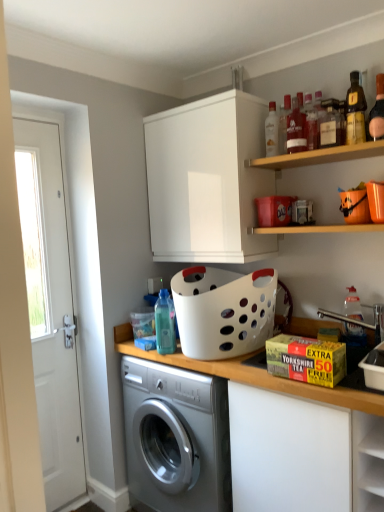
Question: Is clear glass bottle at upper center, which is counted as the second bottle, starting from the left, inside or outside of translucent glass bottle at upper right, placed as the ninth bottle when sorted from left to right?

Choices:
 (A) outside
 (B) inside

Answer: (A)

Question: From a real-world perspective, relative to translucent glass bottle at upper right, which is the first bottle from right to left, is clear glass bottle at upper center, which is counted as the second bottle, starting from the left, vertically above or below?

Choices:
 (A) below
 (B) above

Answer: (A)

Question: Which object is the closest to the translucent plastic bottle at upper center, the 3th bottle viewed from the left?

Choices:
 (A) wooden shelf at upper right, which is the second shelf from top to bottom
 (B) matte glass bottle at upper center, which ranks as the 4th bottle in left-to-right order
 (C) white matte cabinet at upper center
 (D) wooden shelf at upper right, the second shelf when ordered from bottom to top
 (E) matte plastic bottle at upper right, placed as the fifth bottle when sorted from left to right

Answer: (B)

Question: Based on their relative distances, which object is nearer to the white glossy door at left?

Choices:
 (A) matte glass bottle at upper center, which is counted as the 6th bottle, starting from the right
 (B) translucent plastic bottle at upper center, which is the 7th bottle in right-to-left order
 (C) clear glass bottle at upper center, the eighth bottle in the right-to-left sequence
 (D) matte plastic bottle at upper right, marked as the 5th bottle in a right-to-left arrangement
 (E) translucent glass bottle at upper right, placed as the fourth bottle when sorted from right to left

Answer: (C)